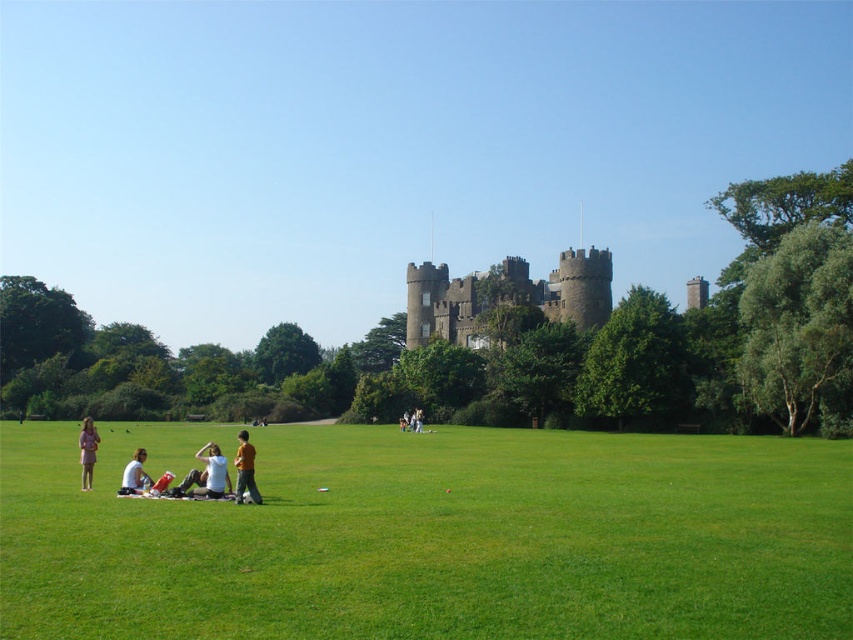
Consider the image. You are a photographer standing at the edge of the grassy field near the white cotton shirt at lower left and light brown leather jacket at center. You want to take a photo of the castle without any people blocking the view. Which person should you move to ensure the castle is fully visible?

You should move the white cotton shirt at lower left because it is in front of the light brown leather jacket at center and might be blocking the view to the castle.

You are standing at the center of the grassy area in front of Malahide Castle. You see a white cotton shirt at lower center and a pink fabric dress at lower left. Which one is positioned to the right of the other?

The white cotton shirt at lower center is positioned to the right of the pink fabric dress at lower left.

You are standing at the entrance of Malahide Castle and want to reach a specific point marked at coordinates point (469,305). Can you estimate how far this point is from your current position?

The distance of point (469,305) from viewer is 409.76 feet.